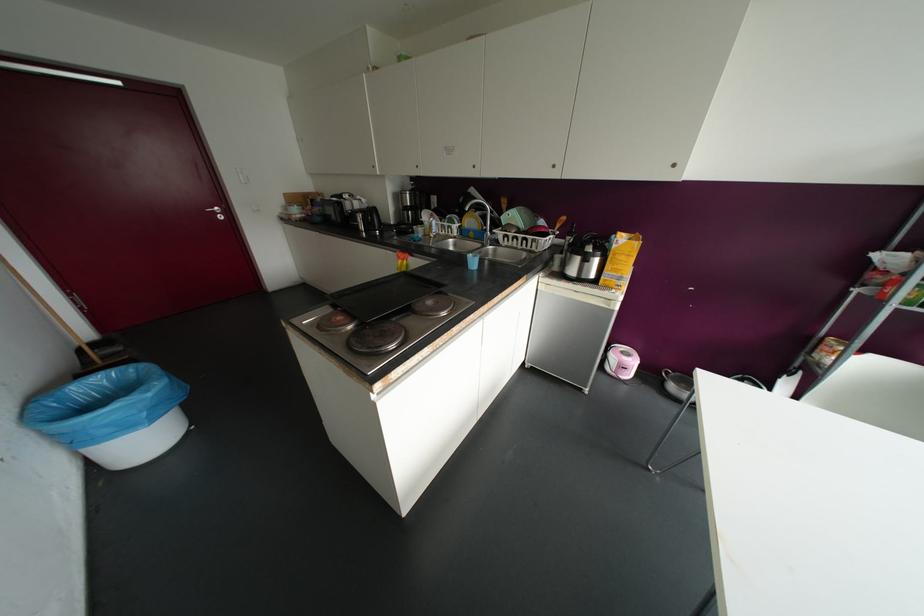
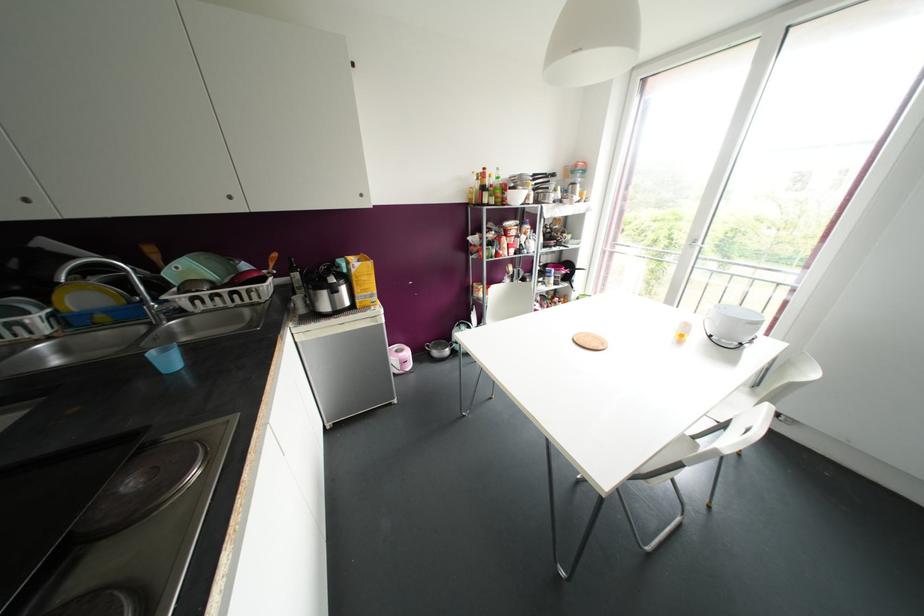
Where in the second image is the point corresponding to the point at 469,233 from the first image?

(101, 317)